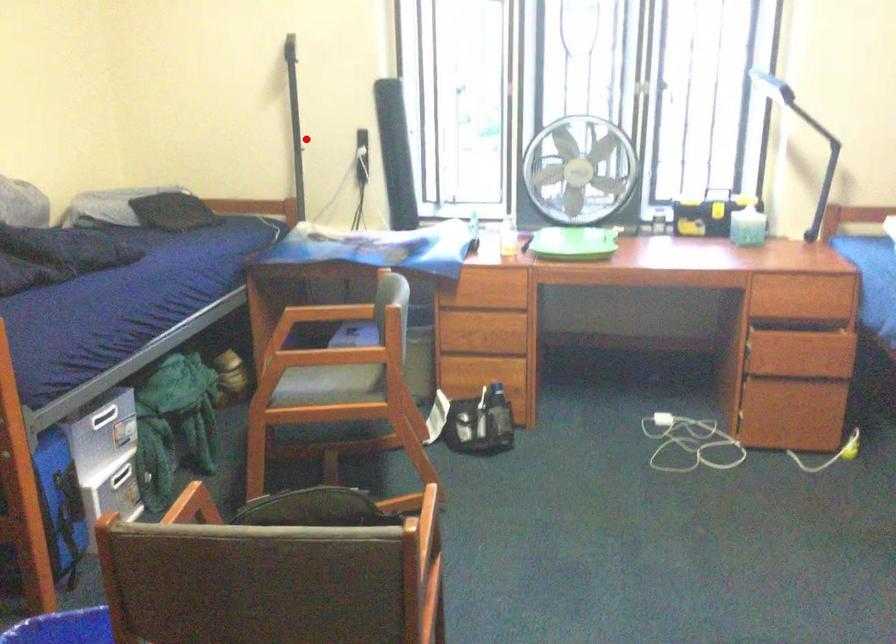
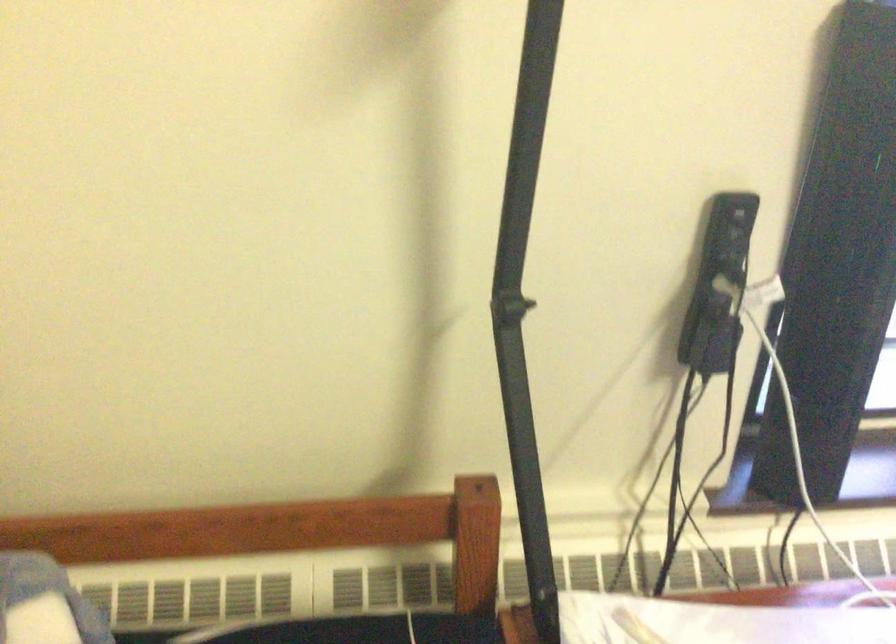
Question: I am providing you with two images of the same scene from different viewpoints. Image1 has a red point marked. In image2, the corresponding 3D location appears at what relative position? Reply with the corresponding letter.

Choices:
 (A) Closer
 (B) Farther

Answer: (A)